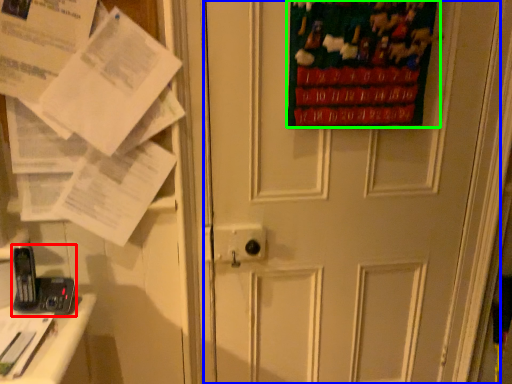
Question: Estimate the real-world distances between objects in this image. Which object is closer to equipment (highlighted by a red box), door (highlighted by a blue box) or poster page (highlighted by a green box)?

Choices:
 (A) door
 (B) poster page

Answer: (A)